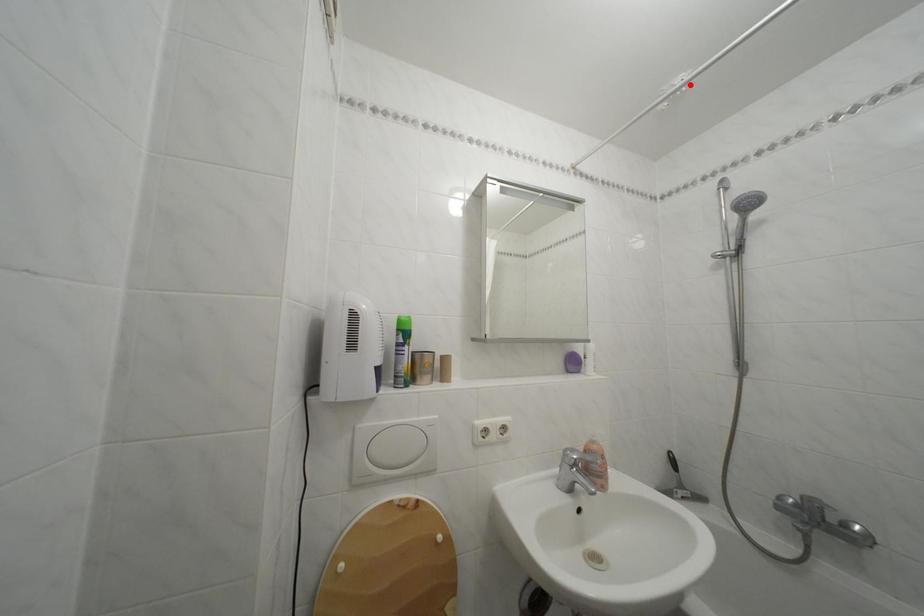
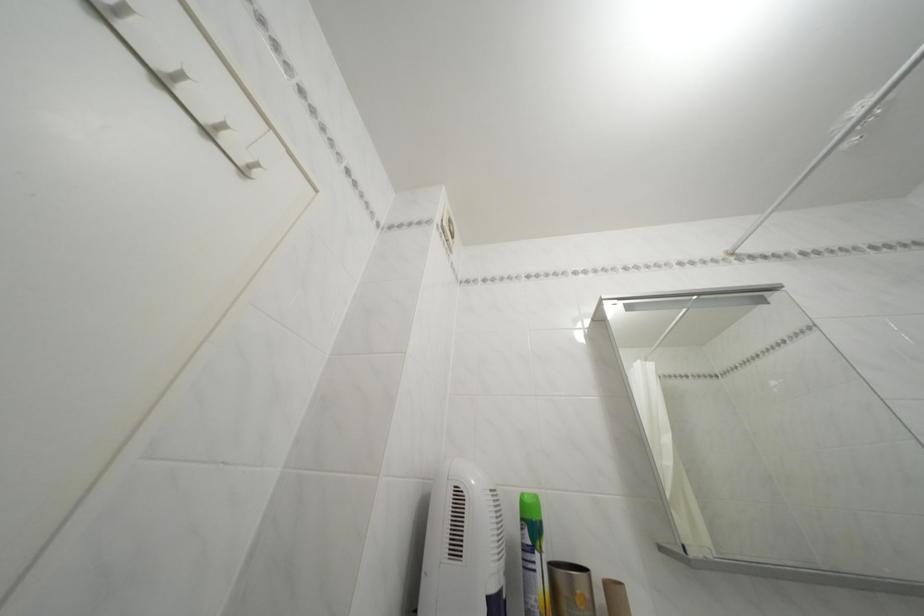
Find the pixel in the second image that matches the highlighted location in the first image.

(869, 114)